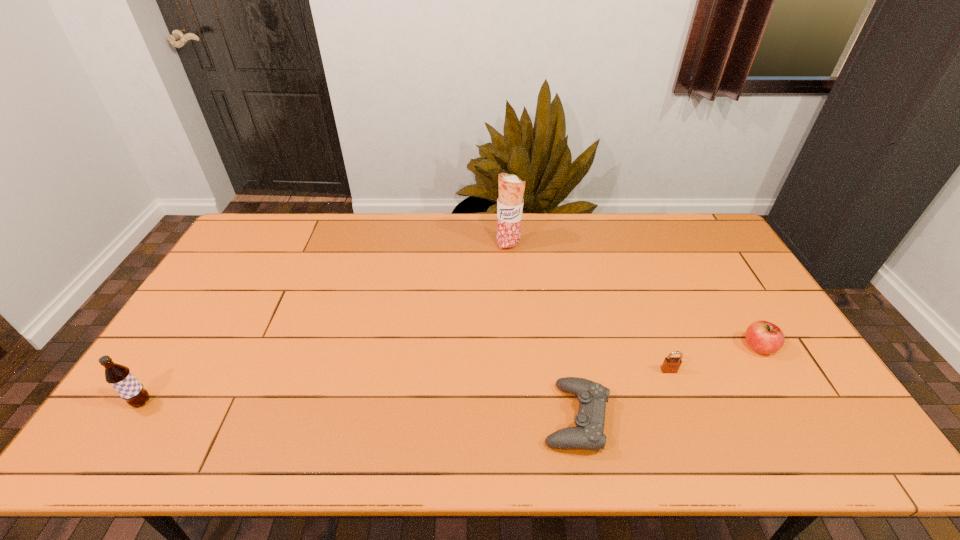
Image resolution: width=960 pixels, height=540 pixels. In order to click on free space between the leftmost object and the third object from right to left in this screenshot , I will do `click(359, 410)`.

The height and width of the screenshot is (540, 960). Find the location of `blank region between the third object from right to left and the leftmost object`. blank region between the third object from right to left and the leftmost object is located at coordinates (359, 410).

Identify the location of free space between the rightmost object and the farthest object. (634, 296).

Identify which object is the third closest to the second object from left to right. Please provide its 2D coordinates. Your answer should be formatted as a tuple, i.e. [(x, y)], where the tuple contains the x and y coordinates of a point satisfying the conditions above.

[(764, 337)]

Where is `object that can be found as the second closest to the leftmost object`? The height and width of the screenshot is (540, 960). object that can be found as the second closest to the leftmost object is located at coordinates (511, 188).

The width and height of the screenshot is (960, 540). Find the location of `vacant space that satisfies the following two spatial constraints: 1. on the front side of the burrito; 2. on the right side of the rightmost object`. vacant space that satisfies the following two spatial constraints: 1. on the front side of the burrito; 2. on the right side of the rightmost object is located at coordinates (516, 347).

Where is `free space that satisfies the following two spatial constraints: 1. on the back side of the root beer; 2. on the left side of the second object from left to right`? free space that satisfies the following two spatial constraints: 1. on the back side of the root beer; 2. on the left side of the second object from left to right is located at coordinates (244, 245).

Find the location of a particular element. The image size is (960, 540). free space that satisfies the following two spatial constraints: 1. on the front side of the shortest object; 2. on the left side of the farthest object is located at coordinates (522, 418).